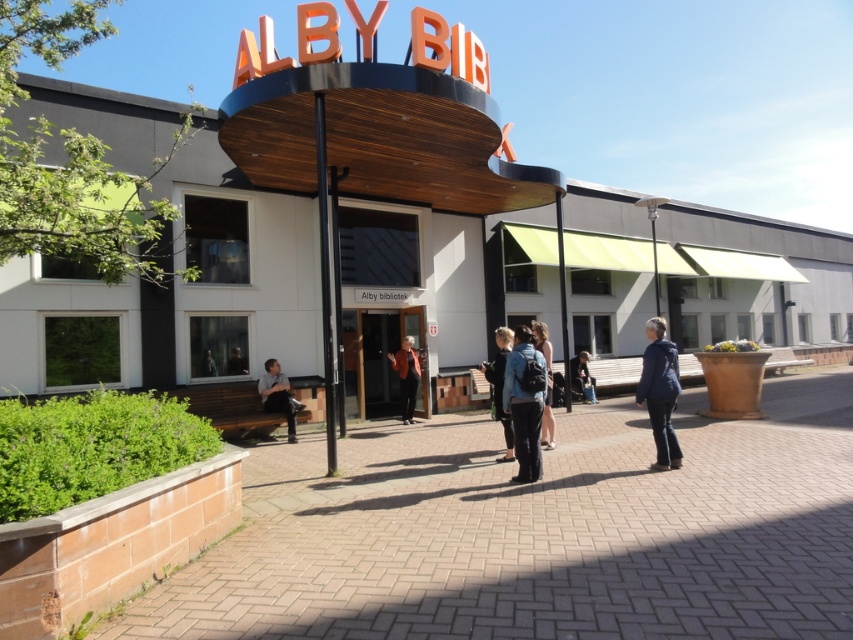
Can you confirm if orange leather jacket at center is shorter than dark blue jeans at lower center?

No, orange leather jacket at center is not shorter than dark blue jeans at lower center.

Does orange leather jacket at center appear under dark blue jeans at lower center?

No, orange leather jacket at center is not below dark blue jeans at lower center.

Does point (412, 372) lie in front of point (585, 380)?

That is True.

You are a GUI agent. You are given a task and a screenshot of the screen. Output one action in this format:
    pyautogui.click(x=<x>, y=<y>)
    Task: Click on the orange leather jacket at center
    This screenshot has height=640, width=853.
    Given the screenshot: What is the action you would take?
    pyautogui.click(x=405, y=376)

Can you confirm if denim jacket at center is thinner than orange leather jacket at center?

Yes, denim jacket at center is thinner than orange leather jacket at center.

Is denim jacket at center positioned before orange leather jacket at center?

Yes, it is.

Between point (512, 436) and point (413, 362), which one is positioned behind?

Positioned behind is point (413, 362).

In order to click on denim jacket at center in this screenshot , I will do `click(500, 387)`.

Is point (659, 454) positioned behind point (489, 381)?

No, it is not.

Which of these two, dark blue jacket at center or denim jacket at center, stands shorter?

denim jacket at center

Is point (659, 449) closer to camera compared to point (486, 362)?

Yes, point (659, 449) is closer to viewer.

Where is `dark blue jacket at center`? Image resolution: width=853 pixels, height=640 pixels. dark blue jacket at center is located at coordinates (660, 392).